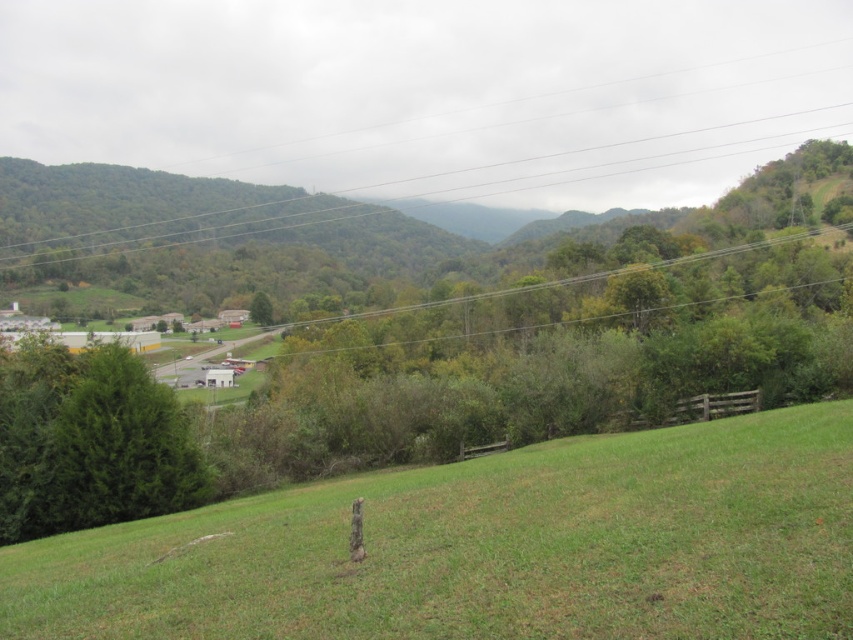
Is green grassy field at center wider than green matte tree at center?

Yes.

Is green grassy field at center below green matte tree at center?

Yes.

Is point (508, 481) farther from camera compared to point (263, 292)?

No, (508, 481) is closer to viewer.

Locate an element on the screen. This screenshot has height=640, width=853. green grassy field at center is located at coordinates (486, 547).

Which is in front, point (398, 472) or point (4, 396)?

Point (4, 396) is in front.

Which is behind, point (814, 536) or point (148, 417)?

Positioned behind is point (148, 417).

Describe the element at coordinates (486, 547) in the screenshot. The width and height of the screenshot is (853, 640). I see `green grassy field at center` at that location.

Identify the location of green grassy field at center. (486, 547).

Can you confirm if green matte tree at lower left is positioned above green matte tree at center?

No.

Locate an element on the screen. green matte tree at lower left is located at coordinates pos(90,442).